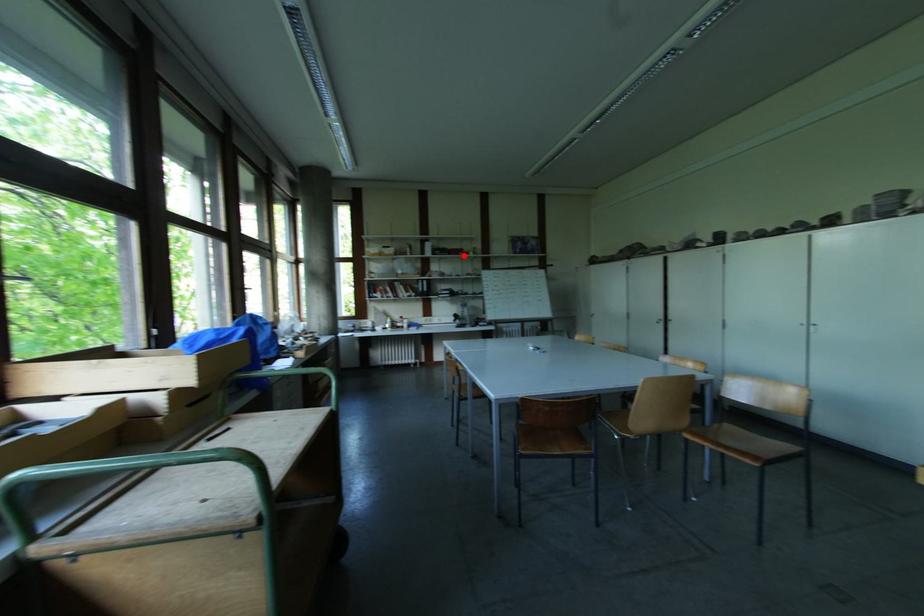
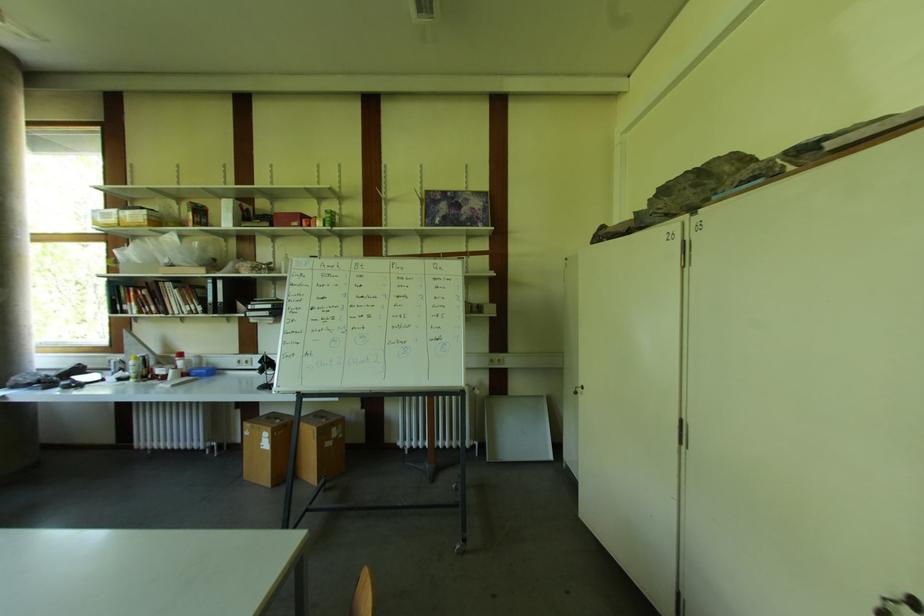
Question: I am providing you with two images of the same scene from different viewpoints. A red point is marked on the first image. Is the red point's position out of view in image 2?

Choices:
 (A) Yes
 (B) No

Answer: (B)